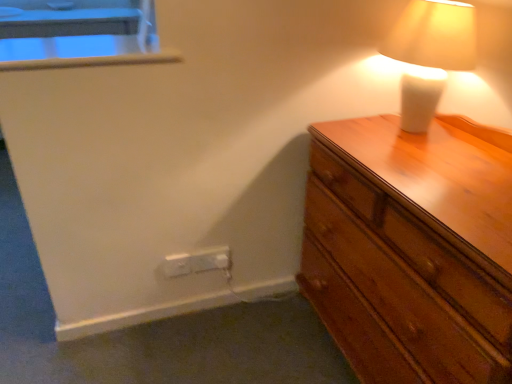
Question: From the image's perspective, does white plastic electric outlet at lower left, the first electric outlet from the left, appear higher than white ceramic lamp at upper right?

Choices:
 (A) no
 (B) yes

Answer: (A)

Question: Is white plastic electric outlet at lower left, the first electric outlet from the left, at the left side of white ceramic lamp at upper right?

Choices:
 (A) yes
 (B) no

Answer: (A)

Question: Is the position of white plastic electric outlet at lower left, the first electric outlet from the left, less distant than that of white ceramic lamp at upper right?

Choices:
 (A) no
 (B) yes

Answer: (A)

Question: Does white plastic electric outlet at lower left, the first electric outlet from the left, have a smaller size compared to white ceramic lamp at upper right?

Choices:
 (A) yes
 (B) no

Answer: (A)

Question: From the image's perspective, is wooden chest of drawers at right positioned above or below white plastic electric outlet at lower left, the first electric outlet from the left?

Choices:
 (A) above
 (B) below

Answer: (A)

Question: Is point (419, 213) closer or farther from the camera than point (164, 273)?

Choices:
 (A) closer
 (B) farther

Answer: (A)

Question: Considering the positions of wooden chest of drawers at right and white plastic electric outlet at lower left, the first electric outlet from the left, in the image, is wooden chest of drawers at right taller or shorter than white plastic electric outlet at lower left, the first electric outlet from the left,?

Choices:
 (A) short
 (B) tall

Answer: (B)

Question: Is wooden chest of drawers at right in front of or behind white plastic electric outlet at lower left, which ranks as the 2th electric outlet in right-to-left order, in the image?

Choices:
 (A) front
 (B) behind

Answer: (A)

Question: Is white plastic electric outlet at lower left, the first electric outlet from the left, inside the boundaries of white plastic electric outlet at lower center, the second electric outlet positioned from the left, or outside?

Choices:
 (A) inside
 (B) outside

Answer: (B)

Question: Considering the positions of white plastic electric outlet at lower left, the first electric outlet from the left, and white plastic electric outlet at lower center, the second electric outlet positioned from the left, in the image, is white plastic electric outlet at lower left, the first electric outlet from the left, bigger or smaller than white plastic electric outlet at lower center, the second electric outlet positioned from the left,?

Choices:
 (A) small
 (B) big

Answer: (A)

Question: Is white plastic electric outlet at lower left, the first electric outlet from the left, wider or thinner than white plastic electric outlet at lower center, which ranks as the first electric outlet in right-to-left order?

Choices:
 (A) thin
 (B) wide

Answer: (A)

Question: In the image, is white plastic electric outlet at lower left, the first electric outlet from the left, positioned in front of or behind white plastic electric outlet at lower center, which ranks as the first electric outlet in right-to-left order?

Choices:
 (A) behind
 (B) front

Answer: (B)

Question: In terms of height, does white plastic window sill at upper left look taller or shorter compared to white ceramic lamp at upper right?

Choices:
 (A) tall
 (B) short

Answer: (B)

Question: From the image's perspective, is white plastic window sill at upper left above or below white ceramic lamp at upper right?

Choices:
 (A) above
 (B) below

Answer: (A)